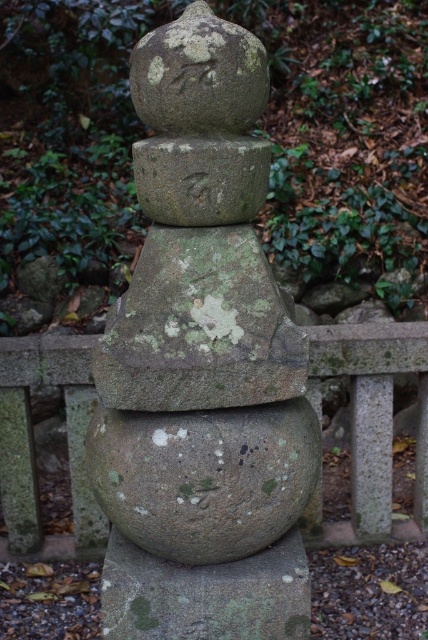
You are a visitor at a temple garden and notice the gray stone fence at center and the green mossy stone at center. Which one is located higher up in the image?

The gray stone fence at center is above the green mossy stone at center, so it is located higher up in the image.

You are standing in front of a traditional Japanese stone monument. There is a point marked at coordinates (202, 365). Which object does this point belong to?

The point at coordinates (202, 365) is on the gray stone statue at center.

You are a visitor at a temple garden and want to take a photo of the gray stone statue at center and the gray stone fence at center. Which one appears larger in the photo?

The gray stone statue at center appears larger in the photo because it is taller than the gray stone fence at center.